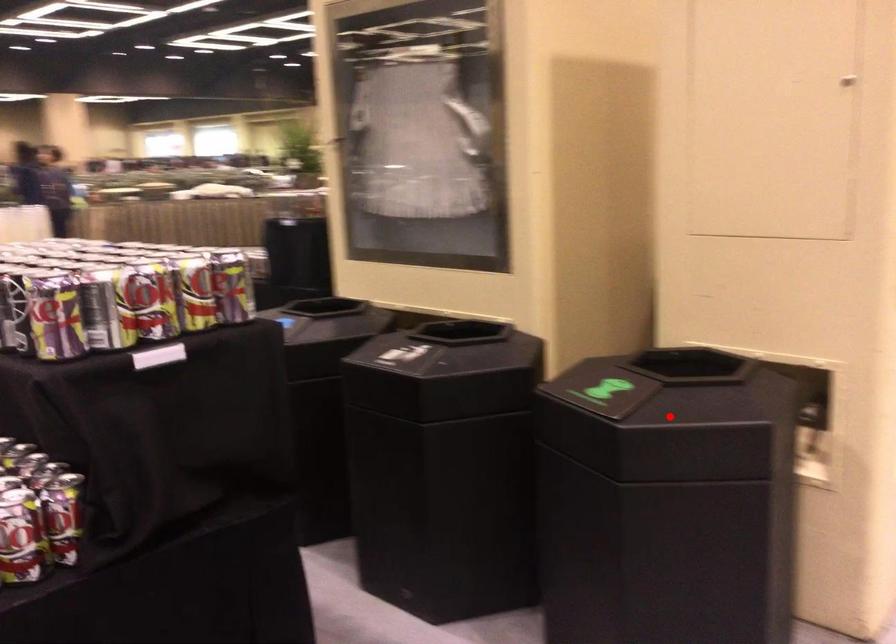
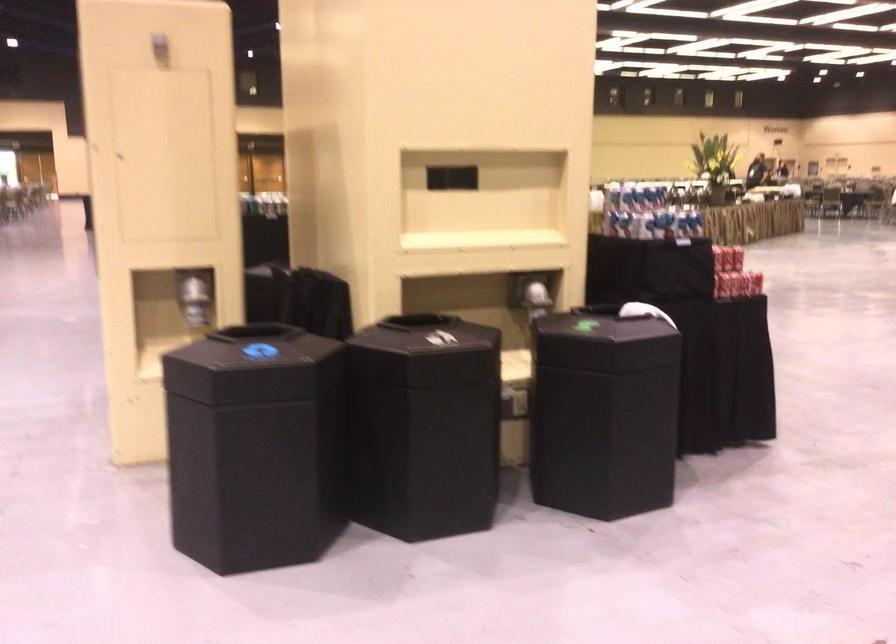
Question: I am providing you with two images of the same scene from different viewpoints. A red point is marked on the first image. At the location where the point appears in image 1, is it still visible in image 2?

Choices:
 (A) Yes
 (B) No

Answer: (B)